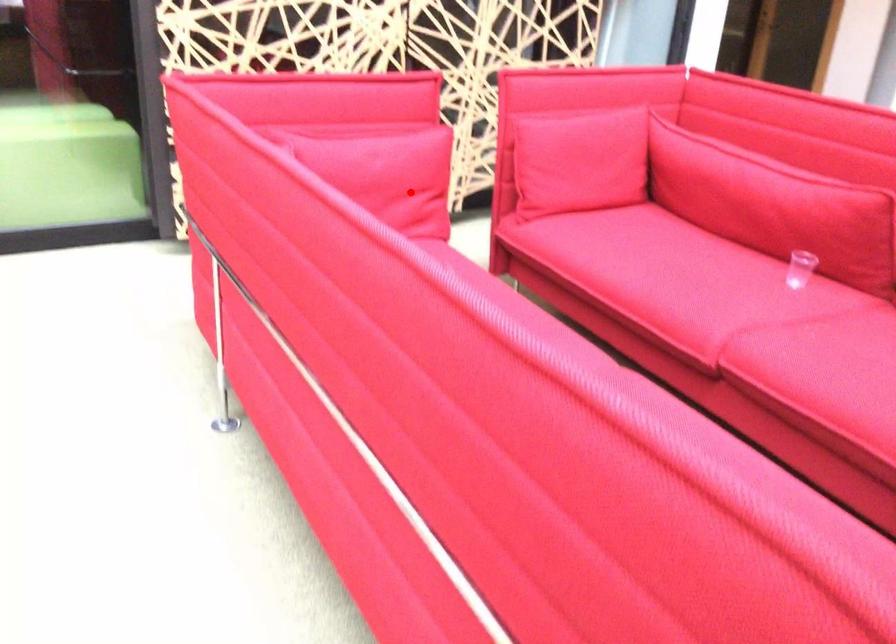
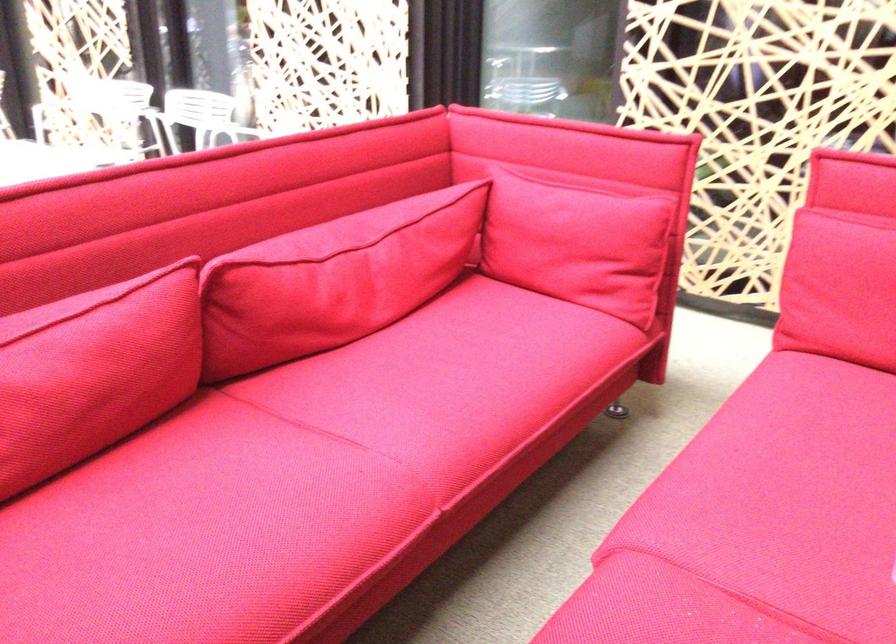
Where in the second image is the point corresponding to the highlighted location from the first image?

(578, 243)